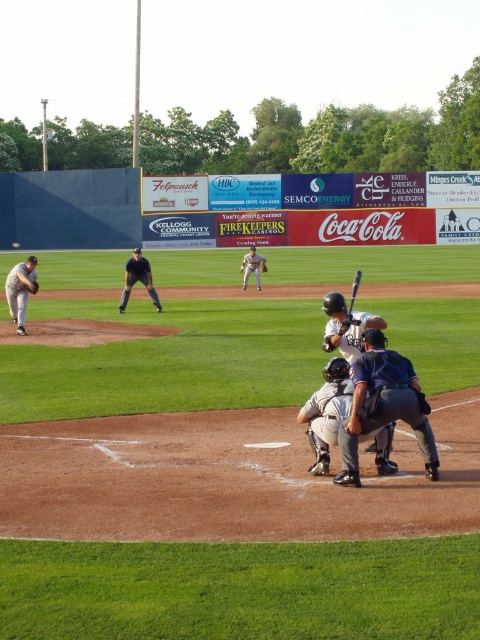
Between black uniform at center and gray uniformed player at center, which one is positioned higher?

gray uniformed player at center

How far apart are black uniform at center and gray uniformed player at center?

black uniform at center and gray uniformed player at center are 4.46 meters apart from each other.

Between point (135, 268) and point (256, 259), which one is positioned in front?

Point (135, 268) is more forward.

You are a GUI agent. You are given a task and a screenshot of the screen. Output one action in this format:
    pyautogui.click(x=<x>, y=<y>)
    Task: Click on the black uniform at center
    
    Given the screenshot: What is the action you would take?
    pyautogui.click(x=137, y=280)

Which is in front, point (388, 365) or point (26, 282)?

Point (388, 365) is in front.

Identify the location of dark blue uniform at center. This screenshot has height=640, width=480. (384, 404).

Which is behind, point (367, 376) or point (262, 269)?

The point (262, 269) is behind.

Where is `dark blue uniform at center`? dark blue uniform at center is located at coordinates (384, 404).

At what (x,y) coordinates should I click in order to perform the action: click on dark blue uniform at center. Please return your answer as a coordinate pair (x, y). Looking at the image, I should click on (384, 404).